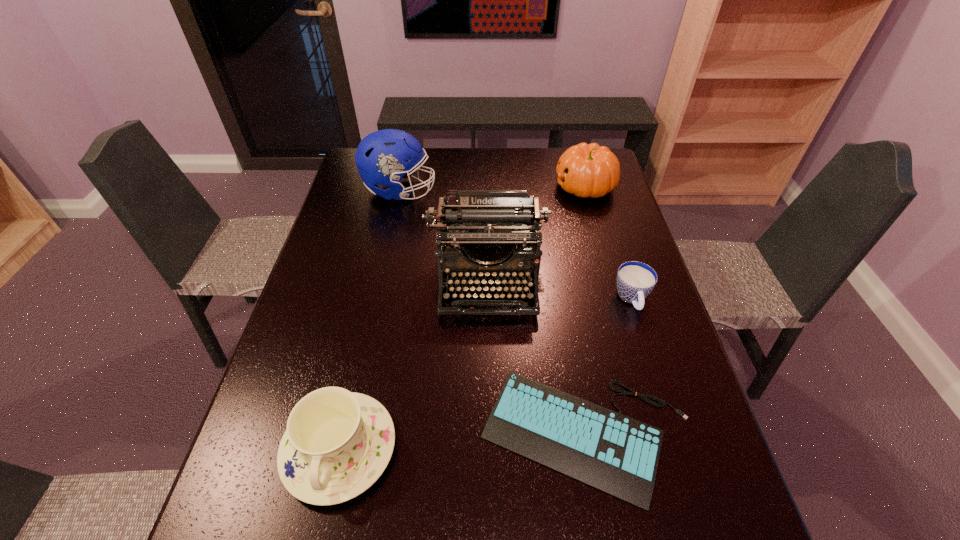
Identify the location of football helmet. The image size is (960, 540). (382, 157).

The image size is (960, 540). In order to click on typewriter in this screenshot , I will do `click(501, 226)`.

What are the coordinates of `pumpkin` in the screenshot? It's located at pyautogui.click(x=586, y=170).

At what (x,y) coordinates should I click in order to perform the action: click on chinaware. Please return your answer as a coordinate pair (x, y). This screenshot has width=960, height=540. Looking at the image, I should click on (337, 443).

The height and width of the screenshot is (540, 960). I want to click on the fifth tallest object, so click(x=635, y=280).

Find the location of a particular element. Image resolution: width=960 pixels, height=540 pixels. computer keyboard is located at coordinates (619, 455).

This screenshot has width=960, height=540. Identify the location of free space located on the face guard of the football helmet. (524, 190).

Where is `vacant area situated on the typing side of the typewriter`? vacant area situated on the typing side of the typewriter is located at coordinates (491, 464).

Identify the location of free location located on the carved face of the pumpkin. (479, 187).

The width and height of the screenshot is (960, 540). In order to click on vacant area situated 0.140m on the carved face of the pumpkin in this screenshot , I will do `click(514, 187)`.